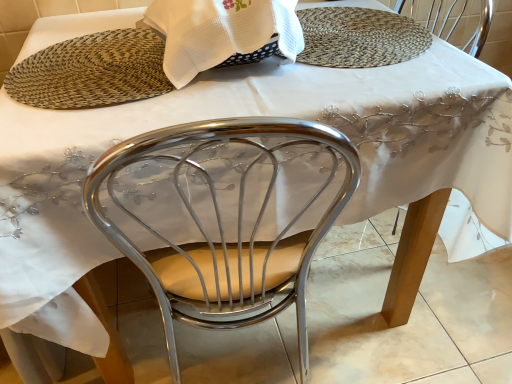
Locate an element on the screen. The width and height of the screenshot is (512, 384). free point in front of woven straw placemat at upper center is located at coordinates (353, 88).